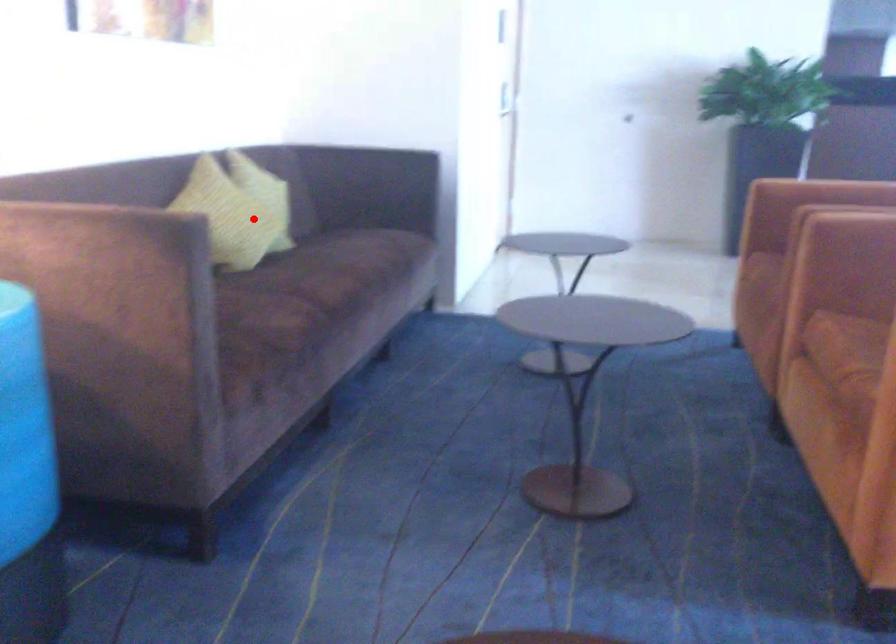
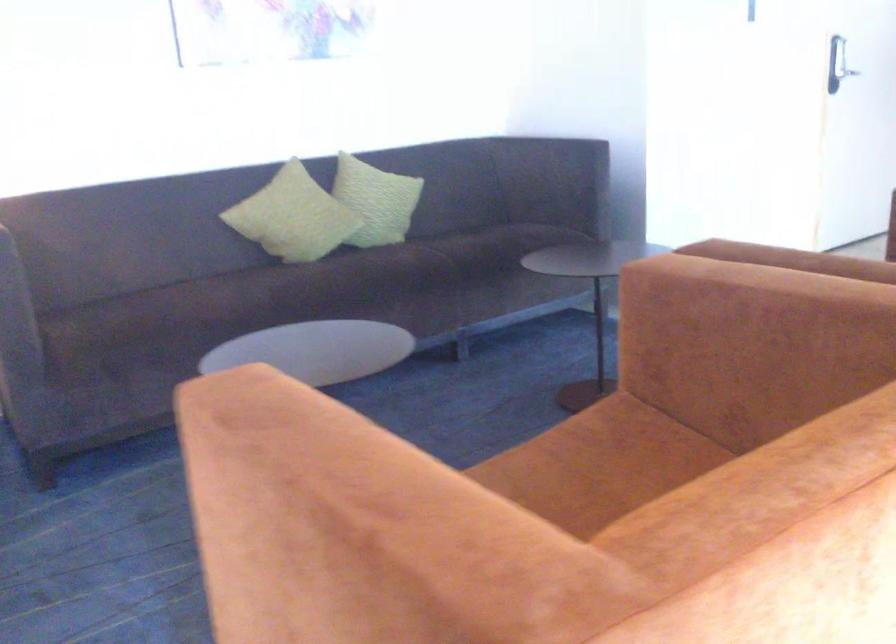
The point at the highlighted location is marked in the first image. Where is the corresponding point in the second image?

(293, 216)